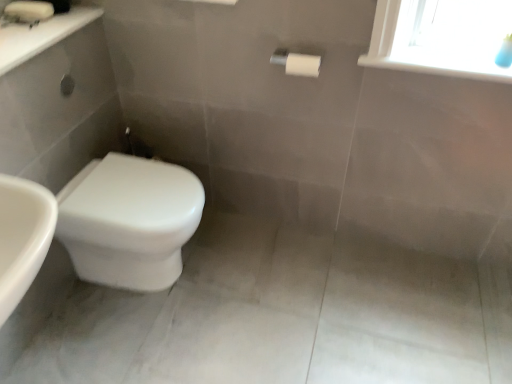
The height and width of the screenshot is (384, 512). I want to click on blank space situated above white plastic window sill at upper right (from a real-world perspective), so click(x=440, y=54).